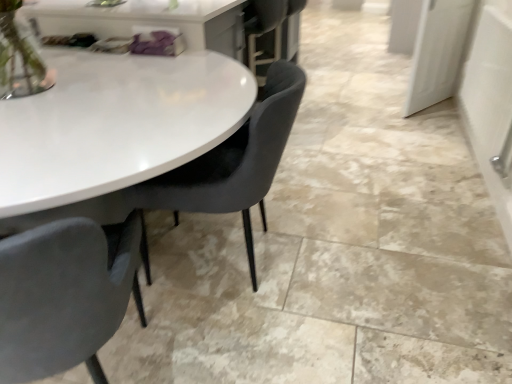
Where is `unoccupied space behind white glossy door at upper right`? The height and width of the screenshot is (384, 512). unoccupied space behind white glossy door at upper right is located at coordinates (383, 88).